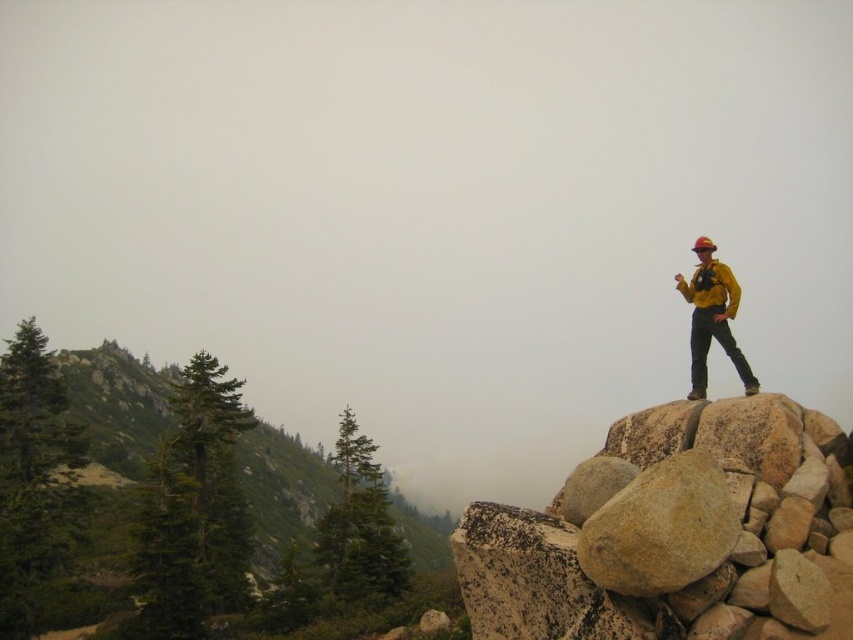
Is green textured trees at left positioned before smooth beige rock at center?

No, it is not.

Does green textured trees at left have a lesser width compared to smooth beige rock at center?

No, green textured trees at left is not thinner than smooth beige rock at center.

Between point (306, 481) and point (618, 547), which one is positioned behind?

Positioned behind is point (306, 481).

Image resolution: width=853 pixels, height=640 pixels. What are the coordinates of `green textured trees at left` in the screenshot? It's located at (117, 403).

How distant is yellowish-brown granite boulder at upper right from yellow matte jacket at upper right?

15.14 feet

Which is in front, point (720, 566) or point (712, 284)?

Point (720, 566) is more forward.

This screenshot has width=853, height=640. What are the coordinates of `yellowish-brown granite boulder at upper right` in the screenshot? It's located at (672, 536).

Is point (239, 449) positioned after point (740, 289)?

That is True.

This screenshot has width=853, height=640. Identify the location of green textured trees at left. (117, 403).